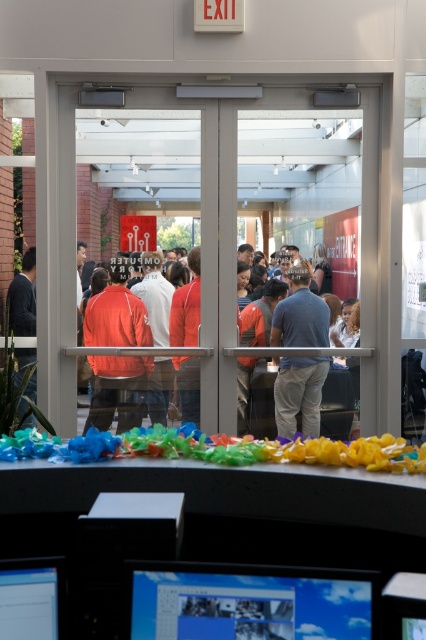
Measure the distance between dark blue shirt at center and camera.

They are 5.54 meters apart.

Who is more forward, (x=296, y=294) or (x=34, y=573)?

Point (x=34, y=573) is in front.

Between point (291, 340) and point (46, 602), which one is positioned behind?

The point (291, 340) is more distant.

At what (x,y) coordinates should I click in order to perform the action: click on dark blue shirt at center. Please return your answer as a coordinate pair (x, y). Image resolution: width=426 pixels, height=640 pixels. Looking at the image, I should click on (299, 394).

Can you confirm if matte plastic monitor at lower center is wider than dark gray suit at left?

Indeed, matte plastic monitor at lower center has a greater width compared to dark gray suit at left.

From the picture: Which is more to the left, matte plastic monitor at lower center or dark gray suit at left?

dark gray suit at left

What do you see at coordinates (250, 602) in the screenshot? The image size is (426, 640). I see `matte plastic monitor at lower center` at bounding box center [250, 602].

You are a GUI agent. You are given a task and a screenshot of the screen. Output one action in this format:
    pyautogui.click(x=<x>, y=<y>)
    Task: Click on the matte plastic monitor at lower center
    This screenshot has height=640, width=426.
    Given the screenshot: What is the action you would take?
    pyautogui.click(x=250, y=602)

Does dark blue shirt at center appear over dark gray suit at left?

Actually, dark blue shirt at center is below dark gray suit at left.

Can you confirm if dark blue shirt at center is wider than dark gray suit at left?

Yes, dark blue shirt at center is wider than dark gray suit at left.

Is point (322, 307) positioned behind point (36, 397)?

Yes, point (322, 307) is farther from viewer.

You are a GUI agent. You are given a task and a screenshot of the screen. Output one action in this format:
    pyautogui.click(x=<x>, y=<y>)
    Task: Click on the dark blue shirt at center
    The width and height of the screenshot is (426, 640).
    Given the screenshot: What is the action you would take?
    pyautogui.click(x=299, y=394)